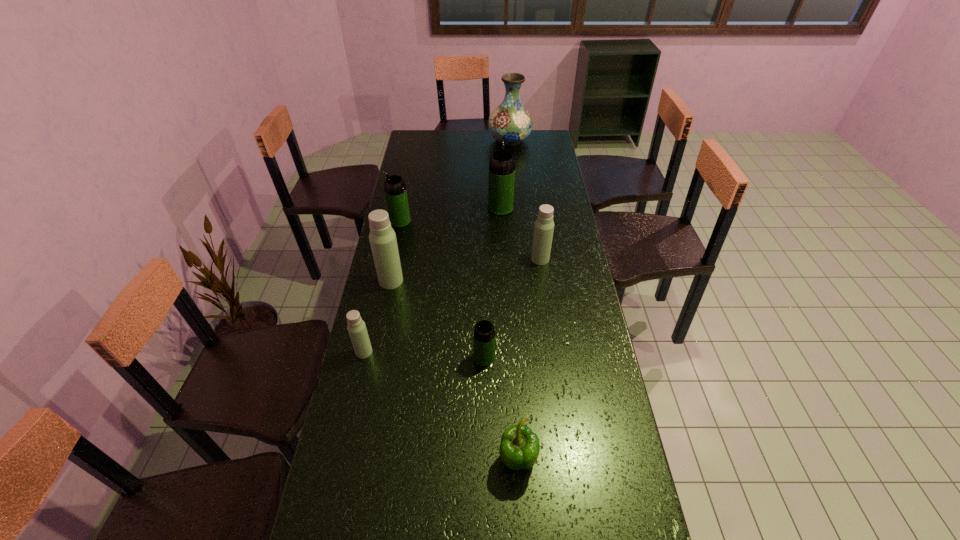
You are a GUI agent. You are given a task and a screenshot of the screen. Output one action in this format:
    pyautogui.click(x=<x>, y=<y>)
    Task: Click on the vase
    
    Given the screenshot: What is the action you would take?
    click(510, 121)

At what (x,y) coordinates should I click in order to perform the action: click on the farthest object. Please return your answer as a coordinate pair (x, y). The image size is (960, 540). Looking at the image, I should click on (510, 121).

Identify the location of the biggest green thermos bottle. The height and width of the screenshot is (540, 960). (501, 183).

The height and width of the screenshot is (540, 960). In order to click on the second farthest light thermos bottle in this screenshot , I will do `click(382, 237)`.

I want to click on the biggest light thermos bottle, so click(x=382, y=237).

Find the location of a particular element. the fourth farthest object is located at coordinates (544, 225).

Find the location of a particular element. the rightmost light thermos bottle is located at coordinates point(544,225).

Locate an element on the screen. the second biggest green thermos bottle is located at coordinates (395, 190).

Find the location of a particular element. This screenshot has width=960, height=540. the nearest green thermos bottle is located at coordinates (484, 333).

At what (x,y) coordinates should I click in order to perform the action: click on the smallest light thermos bottle. Please return your answer as a coordinate pair (x, y). Looking at the image, I should click on (356, 327).